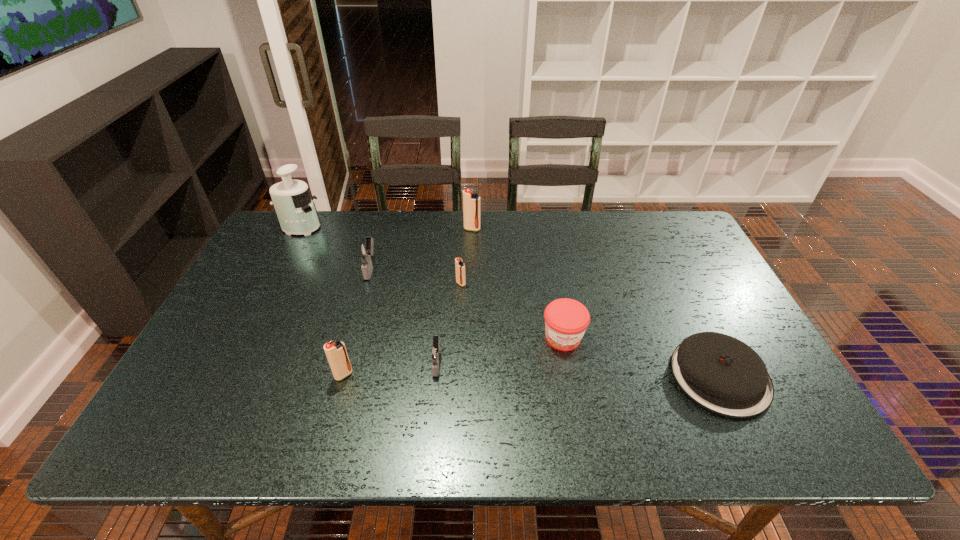
At what (x,y) coordinates should I click in order to perform the action: click on the second farthest red igniter. Please return your answer as a coordinate pair (x, y). This screenshot has height=540, width=960. Looking at the image, I should click on (459, 265).

Where is `the smaller gray igniter`? This screenshot has height=540, width=960. the smaller gray igniter is located at coordinates (435, 352).

Identify the location of the nearer gray igniter. (435, 352).

You are a GUI agent. You are given a task and a screenshot of the screen. Output one action in this format:
    pyautogui.click(x=<x>, y=<y>)
    Task: Click on the pancake
    The image size is (960, 540).
    Given the screenshot: What is the action you would take?
    pyautogui.click(x=722, y=374)

Find the location of a particular element. the shortest object is located at coordinates (722, 374).

Identify the location of free space located 0.220m on the front of the leftmost object. This screenshot has width=960, height=540. (274, 282).

You are a GUI agent. You are given a task and a screenshot of the screen. Output one action in this format:
    pyautogui.click(x=<x>, y=<y>)
    Task: Click on the free location located on the right of the seventh shortest object
    This screenshot has height=540, width=960.
    Given the screenshot: What is the action you would take?
    coord(522,229)

At what (x,y) coordinates should I click in order to perform the action: click on free space located 0.330m on the left of the left gray igniter. Please return your answer as a coordinate pair (x, y). The image size is (960, 540). Looking at the image, I should click on (252, 268).

This screenshot has height=540, width=960. I want to click on vacant space located on the left of the nearest red igniter, so click(x=306, y=375).

The width and height of the screenshot is (960, 540). I want to click on free point located 0.120m on the label side of the red jam, so click(x=574, y=397).